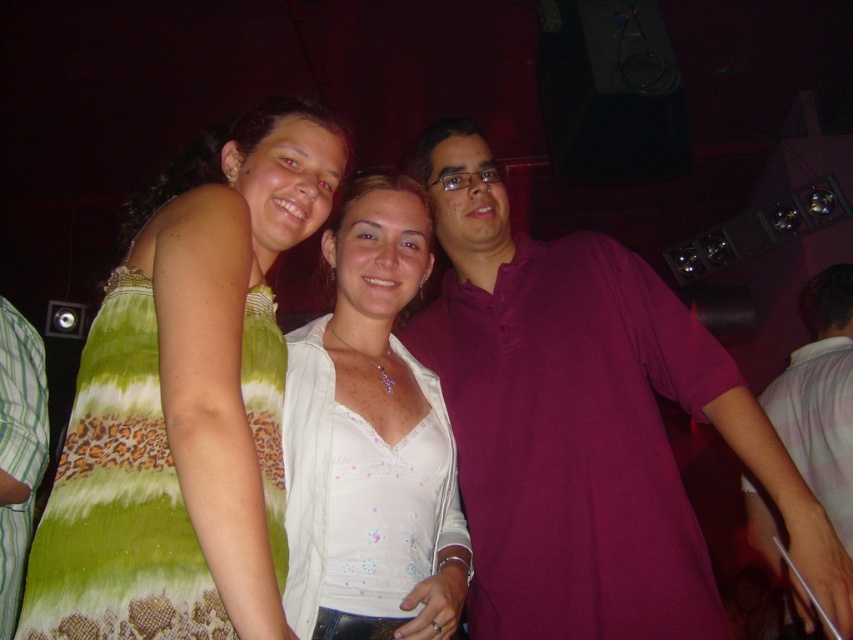
You are a photographer at a party and need to adjust the lighting between the white lace top at center and the green striped shirt at left. The minimum distance required for proper lighting is 30 inches. Can you achieve proper lighting between them?

The white lace top at center is 30.61 inches away from the green striped shirt at left, which exceeds the minimum 30 inches requirement. Therefore, proper lighting can be achieved between them.